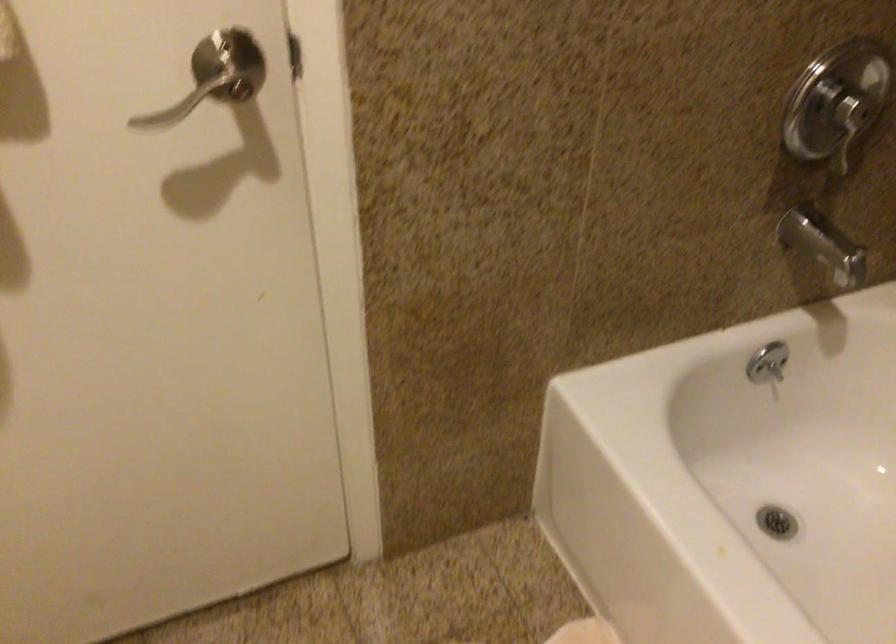
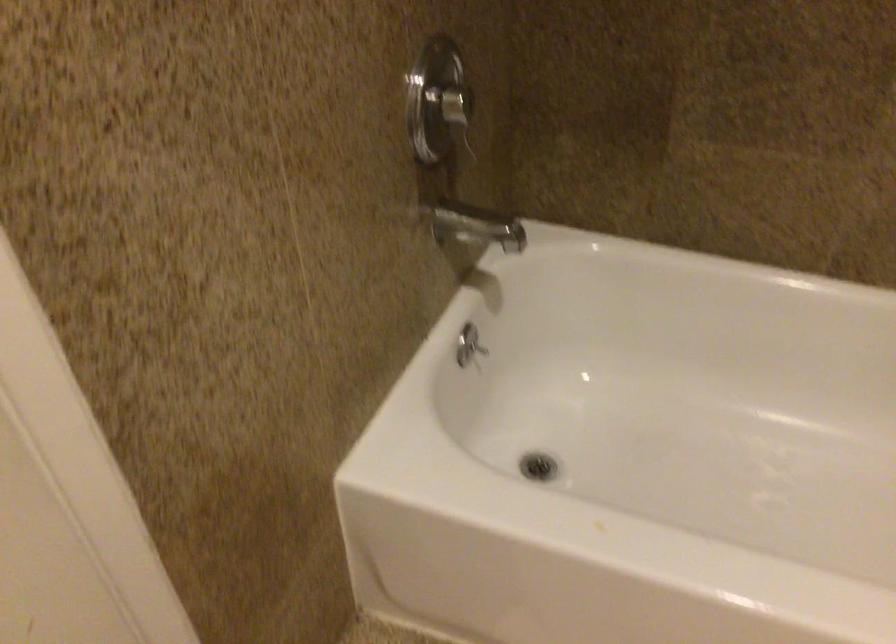
Where in the second image is the point corresponding to pixel 785 375 from the first image?

(478, 348)